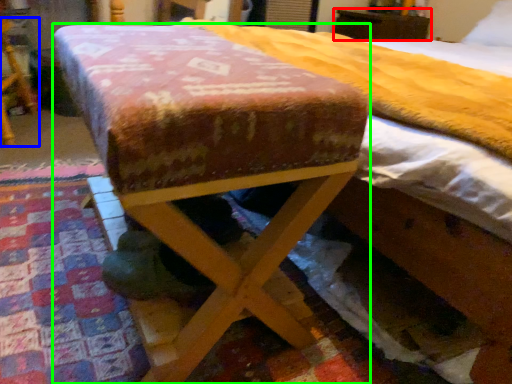
Question: Based on their relative distances, which object is farther from furniture (highlighted by a red box)? Choose from furniture (highlighted by a blue box) and furniture (highlighted by a green box).

Choices:
 (A) furniture
 (B) furniture

Answer: (B)